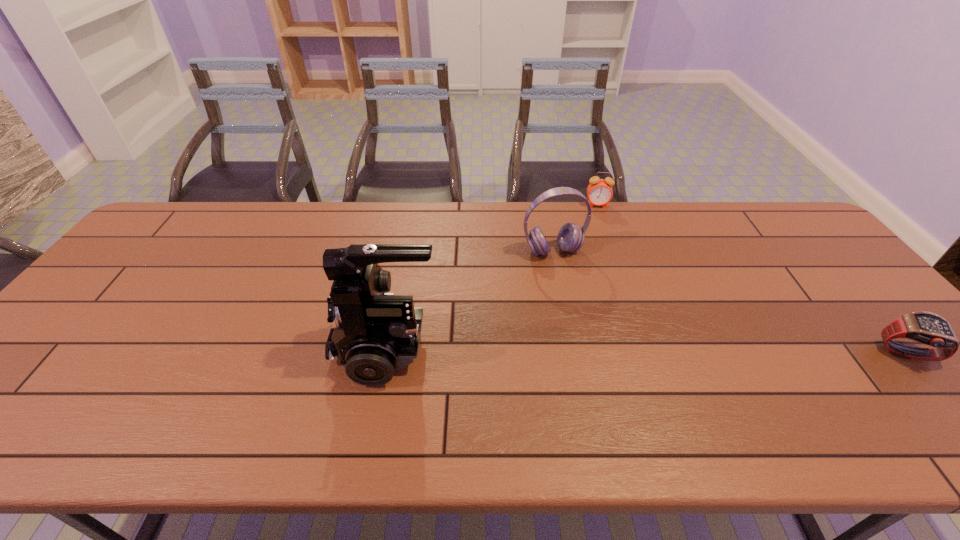
Identify the location of object positioned at the near edge. (375, 333).

The image size is (960, 540). What are the coordinates of `object located in the right edge section of the desktop` in the screenshot? It's located at (928, 328).

Where is `vacant space at the far edge of the desktop`? The image size is (960, 540). vacant space at the far edge of the desktop is located at coordinates (363, 217).

The width and height of the screenshot is (960, 540). In order to click on free space at the near edge in this screenshot , I will do `click(151, 382)`.

Where is `free point at the left edge`? The height and width of the screenshot is (540, 960). free point at the left edge is located at coordinates (121, 308).

In the image, there is a desktop. Identify the location of vacant space at the right edge. (812, 281).

You are a GUI agent. You are given a task and a screenshot of the screen. Output one action in this format:
    pyautogui.click(x=<x>, y=<y>)
    Task: Click on the vacant region at the far right corner of the desktop
    
    Given the screenshot: What is the action you would take?
    pyautogui.click(x=803, y=236)

This screenshot has height=540, width=960. Identify the location of empty space between the watch and the farthest object. (752, 280).

Where is `free space between the headset and the tallest object`? Image resolution: width=960 pixels, height=540 pixels. free space between the headset and the tallest object is located at coordinates (470, 299).

The image size is (960, 540). I want to click on free space that is in between the watch and the third object from right to left, so click(x=730, y=302).